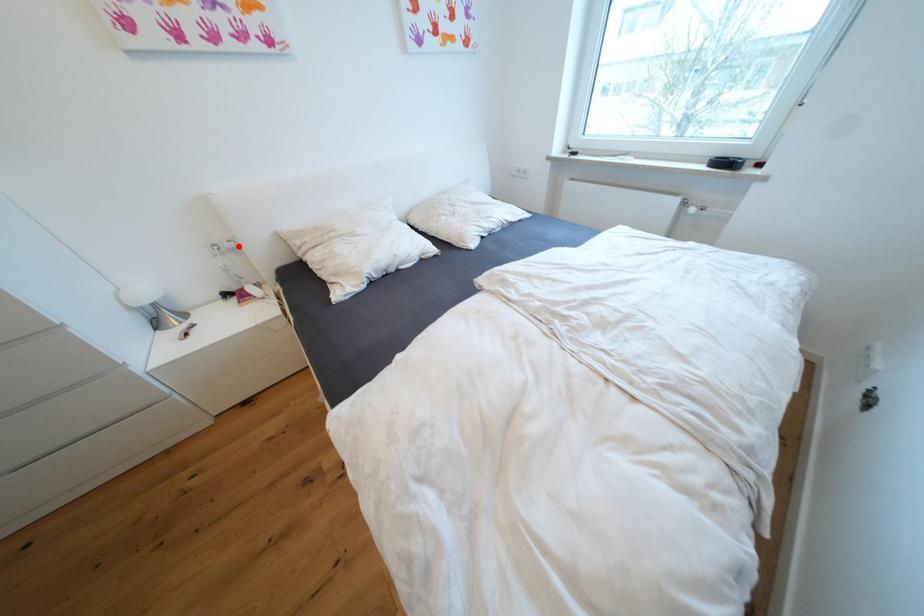
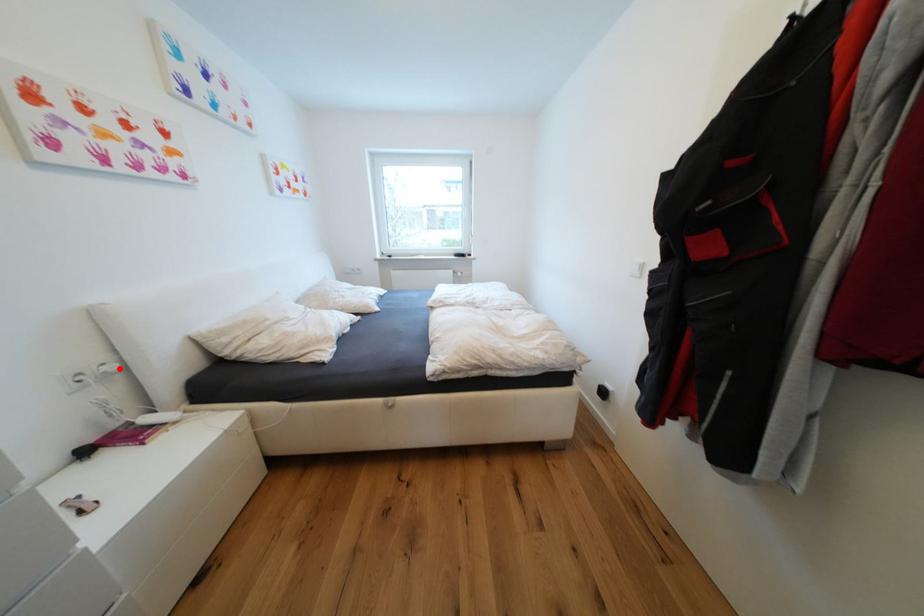
I am providing you with two images of the same scene from different viewpoints. A red point is marked on the first image and another point is marked on the second image. Does the point marked in image1 correspond to the same location as the one in image2?

Yes